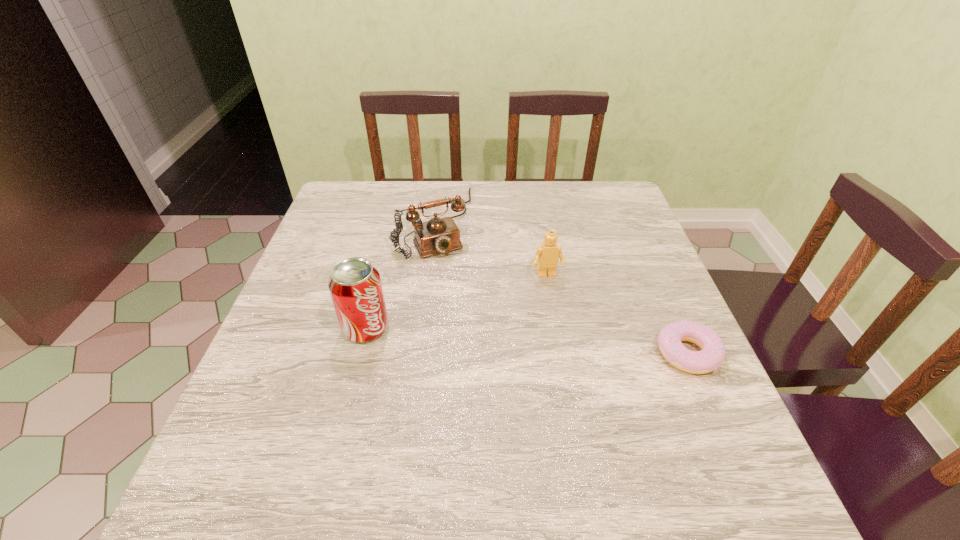
The height and width of the screenshot is (540, 960). I want to click on soda can, so click(355, 286).

Find the location of a particular element. the shortest object is located at coordinates (713, 352).

Where is `the rightmost object`? This screenshot has width=960, height=540. the rightmost object is located at coordinates (713, 352).

Find the location of a particular element. This screenshot has height=540, width=960. telephone is located at coordinates (438, 235).

This screenshot has width=960, height=540. I want to click on the third object from left to right, so [547, 256].

The width and height of the screenshot is (960, 540). Find the location of `Lego`. Lego is located at coordinates (547, 256).

Image resolution: width=960 pixels, height=540 pixels. What are the coordinates of `vacant region located 0.150m on the right of the soda can` in the screenshot? It's located at (458, 328).

You are a GUI agent. You are given a task and a screenshot of the screen. Output one action in this format:
    pyautogui.click(x=<x>, y=<y>)
    Task: Click on the vacant space located on the back of the doughnut
    
    Given the screenshot: What is the action you would take?
    pyautogui.click(x=640, y=246)

I want to click on free space located on the dial of the telephone, so click(x=468, y=307).

Identify the location of blank area located 0.230m on the dial of the telephone. This screenshot has width=960, height=540. (477, 322).